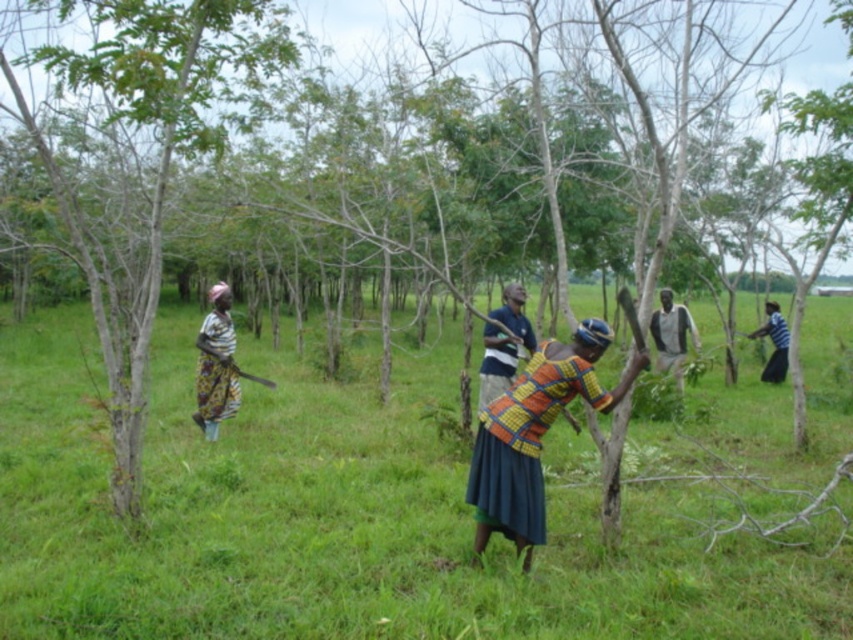
Which is in front, point (160, 467) or point (474, 467)?

Point (474, 467) is in front.

Is green grass at center shorter than multicolored woven cloth at center?

Incorrect, green grass at center's height does not fall short of multicolored woven cloth at center's.

Identify the location of green grass at center. (347, 522).

Where is `blue fabric shirt at center`? Image resolution: width=853 pixels, height=640 pixels. blue fabric shirt at center is located at coordinates (503, 342).

From the picture: Who is shorter, blue fabric shirt at center or dark gray fabric shirt at center?

With less height is blue fabric shirt at center.

You are a GUI agent. You are given a task and a screenshot of the screen. Output one action in this format:
    pyautogui.click(x=<x>, y=<y>)
    Task: Click on the blue fabric shirt at center
    The image size is (853, 640).
    Given the screenshot: What is the action you would take?
    pyautogui.click(x=503, y=342)

Find the location of `blue fabric shirt at center`. blue fabric shirt at center is located at coordinates (503, 342).

Between green leafy tree at left and blue striped shirt at right, which one has more height?

Standing taller between the two is green leafy tree at left.

Between green leafy tree at left and blue striped shirt at right, which one is positioned lower?

blue striped shirt at right is below.

I want to click on green leafy tree at left, so click(136, 163).

This screenshot has width=853, height=640. I want to click on green leafy tree at left, so click(x=136, y=163).